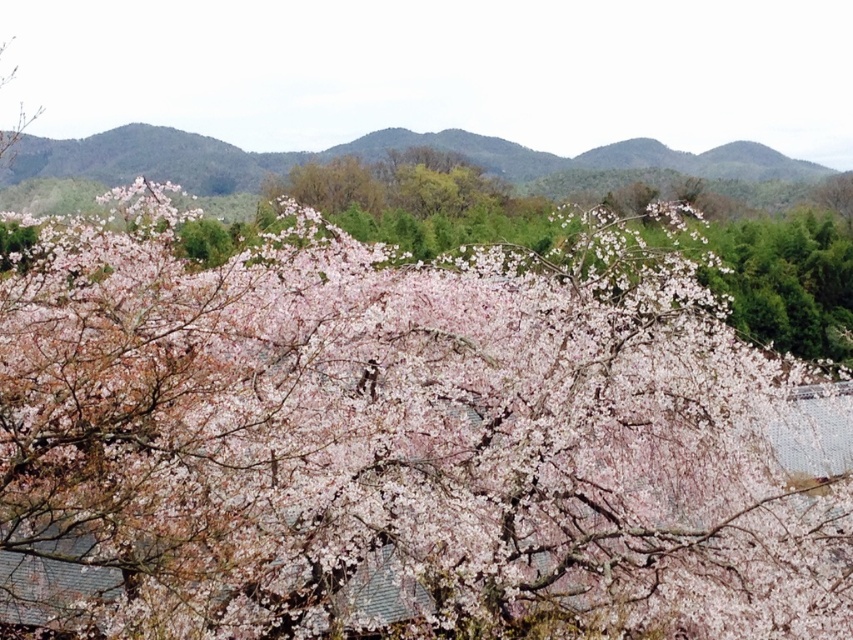
Question: Is pink matte blossoms at center smaller than green leafy mountain at upper center?

Choices:
 (A) yes
 (B) no

Answer: (B)

Question: Which object is closer to the camera taking this photo?

Choices:
 (A) pink matte blossoms at center
 (B) green leafy mountain at upper center

Answer: (A)

Question: Among these points, which one is nearest to the camera?

Choices:
 (A) (387, 424)
 (B) (741, 198)

Answer: (A)

Question: In this image, where is pink matte blossoms at center located relative to green leafy mountain at upper center?

Choices:
 (A) left
 (B) right

Answer: (A)

Question: Is pink matte blossoms at center positioned in front of green leafy mountain at upper center?

Choices:
 (A) yes
 (B) no

Answer: (A)